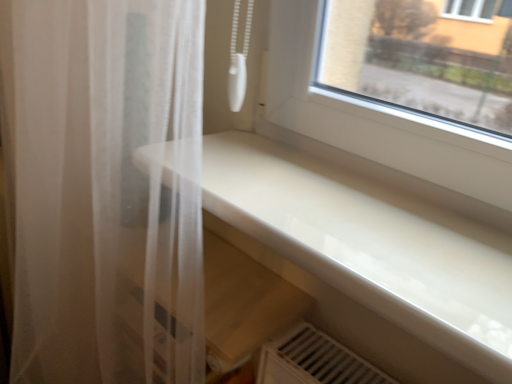
What do you see at coordinates (371, 245) in the screenshot?
I see `white glossy counter top at center` at bounding box center [371, 245].

What is the approximate width of white glossy counter top at center?

The width of white glossy counter top at center is 7.83 inches.

The height and width of the screenshot is (384, 512). I want to click on white glossy counter top at center, so click(371, 245).

Where is `translucent white curtain at left`? The width and height of the screenshot is (512, 384). translucent white curtain at left is located at coordinates (106, 190).

What do you see at coordinates (106, 190) in the screenshot? This screenshot has width=512, height=384. I see `translucent white curtain at left` at bounding box center [106, 190].

Identify the location of white glossy counter top at center. (371, 245).

Is white glossy counter top at center at the left side of translucent white curtain at left?

In fact, white glossy counter top at center is to the right of translucent white curtain at left.

Considering the relative positions of white glossy counter top at center and translucent white curtain at left in the image provided, is white glossy counter top at center behind translucent white curtain at left?

No, it is not.

Is point (475, 266) closer or farther from the camera than point (80, 238)?

Clearly, point (475, 266) is closer to the camera than point (80, 238).

From the image's perspective, is white glossy counter top at center above translucent white curtain at left?

Correct, white glossy counter top at center appears higher than translucent white curtain at left in the image.

In the scene shown: From a real-world perspective, between white glossy counter top at center and translucent white curtain at left, who is vertically higher?

white glossy counter top at center is physically above.

Considering the relative sizes of white glossy counter top at center and translucent white curtain at left in the image provided, is white glossy counter top at center thinner than translucent white curtain at left?

Incorrect, the width of white glossy counter top at center is not less than that of translucent white curtain at left.

Does white glossy counter top at center have a lesser height compared to translucent white curtain at left?

Correct, white glossy counter top at center is not as tall as translucent white curtain at left.

Based on the photo, which of these two, white glossy counter top at center or translucent white curtain at left, is bigger?

With larger size is translucent white curtain at left.

Is white glossy counter top at center positioned beyond the bounds of translucent white curtain at left?

Absolutely, white glossy counter top at center is external to translucent white curtain at left.

Are white glossy counter top at center and translucent white curtain at left beside each other?

No, white glossy counter top at center is not next to translucent white curtain at left.

Is white glossy counter top at center facing towards translucent white curtain at left?

No, white glossy counter top at center does not turn towards translucent white curtain at left.

How many degrees apart are the facing directions of white glossy counter top at center and translucent white curtain at left?

0.157 degrees separate the facing orientations of white glossy counter top at center and translucent white curtain at left.

The image size is (512, 384). Identify the location of curtain on the left of white glossy counter top at center. (106, 190).

Between translucent white curtain at left and white glossy counter top at center, which one appears on the right side from the viewer's perspective?

white glossy counter top at center is more to the right.

Is translucent white curtain at left positioned in front of white glossy counter top at center?

No, it is behind white glossy counter top at center.

Considering the points (125, 380) and (411, 332), which point is behind, point (125, 380) or point (411, 332)?

The point (125, 380) is farther from the camera.

Based on the photo, from the image's perspective, is translucent white curtain at left on white glossy counter top at center?

No, from the image's perspective, translucent white curtain at left is not above white glossy counter top at center.

From a real-world perspective, is translucent white curtain at left positioned above or below white glossy counter top at center?

In terms of real-world spatial position, translucent white curtain at left is below white glossy counter top at center.

Looking at their sizes, would you say translucent white curtain at left is wider or thinner than white glossy counter top at center?

Clearly, translucent white curtain at left has less width compared to white glossy counter top at center.

Considering the sizes of objects translucent white curtain at left and white glossy counter top at center in the image provided, who is shorter, translucent white curtain at left or white glossy counter top at center?

white glossy counter top at center is shorter.

Considering the relative sizes of translucent white curtain at left and white glossy counter top at center in the image provided, is translucent white curtain at left bigger than white glossy counter top at center?

Correct, translucent white curtain at left is larger in size than white glossy counter top at center.

Is translucent white curtain at left situated inside white glossy counter top at center or outside?

translucent white curtain at left is located beyond the bounds of white glossy counter top at center.

Would you say translucent white curtain at left is a long distance from white glossy counter top at center?

They are positioned close to each other.

Is translucent white curtain at left oriented towards white glossy counter top at center?

No, translucent white curtain at left is not turned towards white glossy counter top at center.

What's the angular difference between translucent white curtain at left and white glossy counter top at center's facing directions?

The facing directions of translucent white curtain at left and white glossy counter top at center are 0.157 degrees apart.

Locate an element on the screen. Image resolution: width=512 pixels, height=384 pixels. curtain located below the white glossy counter top at center (from the image's perspective) is located at coordinates (106, 190).

At what (x,y) coordinates should I click in order to perform the action: click on counter top above the translucent white curtain at left (from the image's perspective). Please return your answer as a coordinate pair (x, y). The image size is (512, 384). Looking at the image, I should click on (371, 245).

Find the location of a particular element. counter top that is in front of the translucent white curtain at left is located at coordinates (371, 245).